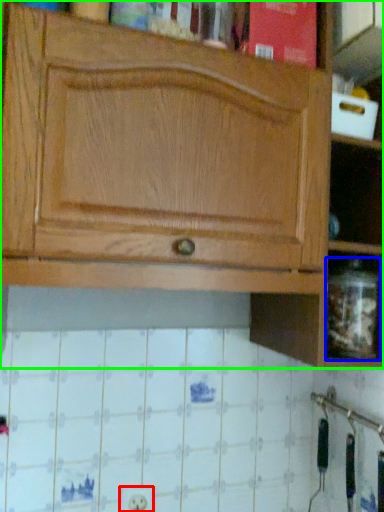
Question: Which is farther away from electric outlet (highlighted by a red box)? glass jar (highlighted by a blue box) or cabinetry (highlighted by a green box)?

Choices:
 (A) glass jar
 (B) cabinetry

Answer: (B)